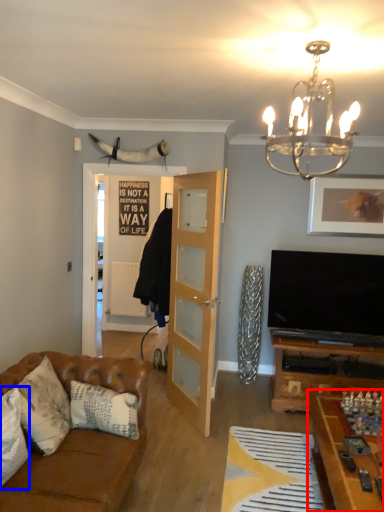
Question: Among these objects, which one is farthest to the camera, table (highlighted by a red box) or pillow (highlighted by a blue box)?

Choices:
 (A) table
 (B) pillow

Answer: (B)